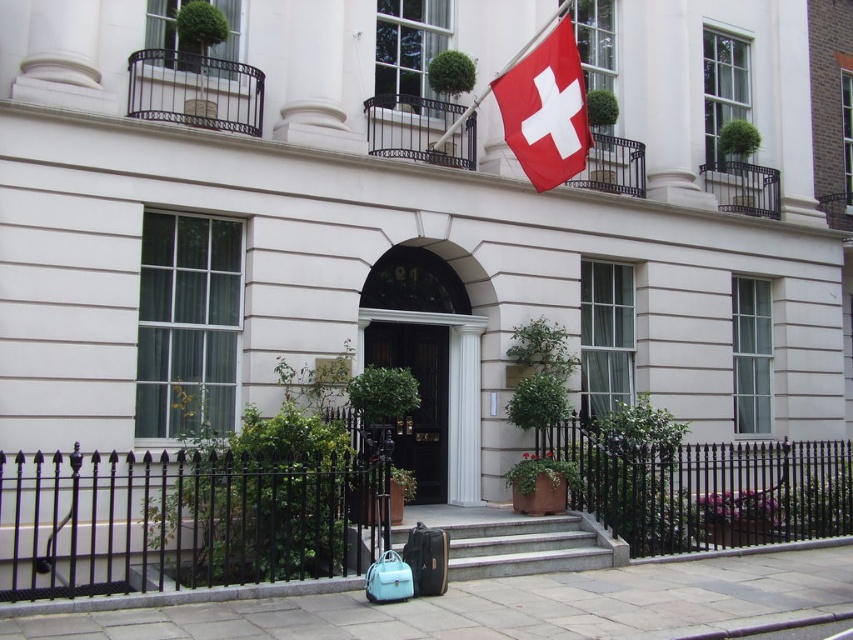
Who is more forward, (561, 93) or (450, 512)?

Point (561, 93) is more forward.

Can you confirm if red fabric flag at upper right is positioned below smooth concrete stairs at center?

Actually, red fabric flag at upper right is above smooth concrete stairs at center.

Describe the element at coordinates (544, 108) in the screenshot. I see `red fabric flag at upper right` at that location.

The image size is (853, 640). What are the coordinates of `red fabric flag at upper right` in the screenshot? It's located at (544, 108).

Which of these two, smooth concrete stairs at center or black wooden door at center, stands taller?

With more height is black wooden door at center.

Is smooth concrete stairs at center bigger than black wooden door at center?

Indeed, smooth concrete stairs at center has a larger size compared to black wooden door at center.

The height and width of the screenshot is (640, 853). Identify the location of smooth concrete stairs at center. (524, 544).

Is red fabric flag at upper right thinner than black wooden door at center?

No.

Describe the element at coordinates (544, 108) in the screenshot. I see `red fabric flag at upper right` at that location.

Is point (573, 54) positioned before point (421, 360)?

Yes, point (573, 54) is in front of point (421, 360).

Identify the location of red fabric flag at upper right. This screenshot has width=853, height=640. (544, 108).